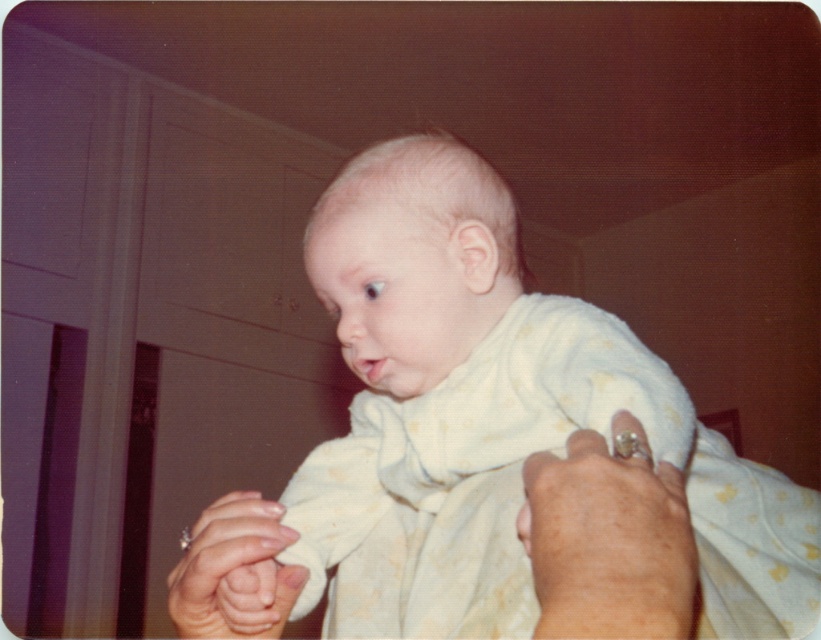
Question: Is white soft cloth at center behind smooth skin hand at lower right?

Choices:
 (A) yes
 (B) no

Answer: (A)

Question: Which point appears farthest from the camera in this image?

Choices:
 (A) (531, 557)
 (B) (480, 282)

Answer: (B)

Question: Considering the relative positions of white soft cloth at center and smooth skin hand at lower left in the image provided, where is white soft cloth at center located with respect to smooth skin hand at lower left?

Choices:
 (A) below
 (B) above

Answer: (B)

Question: Does white soft cloth at center come in front of smooth skin hand at lower left?

Choices:
 (A) no
 (B) yes

Answer: (B)

Question: Which of the following is the closest to the observer?

Choices:
 (A) smooth skin hand at lower right
 (B) white soft cloth at center
 (C) smooth skin hand at lower left

Answer: (A)

Question: Which is nearer to the smooth skin hand at lower right?

Choices:
 (A) smooth skin hand at lower left
 (B) white soft cloth at center

Answer: (B)